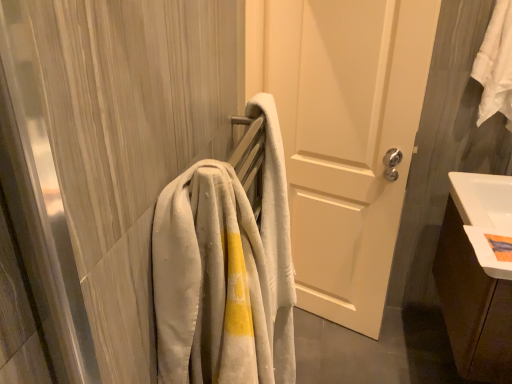
Question: Considering the positions of point (472, 72) and point (449, 336), is point (472, 72) closer or farther from the camera than point (449, 336)?

Choices:
 (A) closer
 (B) farther

Answer: (B)

Question: From a real-world perspective, is white cotton towel at upper right positioned above or below brown wood cabinet at lower right?

Choices:
 (A) above
 (B) below

Answer: (A)

Question: Estimate the real-world distances between objects in this image. Which object is farther from the white matte door at center?

Choices:
 (A) light gray plush towel at left
 (B) white glossy sink at lower right
 (C) brown wood cabinet at lower right
 (D) white cotton towel at upper right

Answer: (A)

Question: Estimate the real-world distances between objects in this image. Which object is closer to the brown wood cabinet at lower right?

Choices:
 (A) light gray plush towel at left
 (B) white matte door at center
 (C) white cotton towel at upper right
 (D) white glossy sink at lower right

Answer: (D)